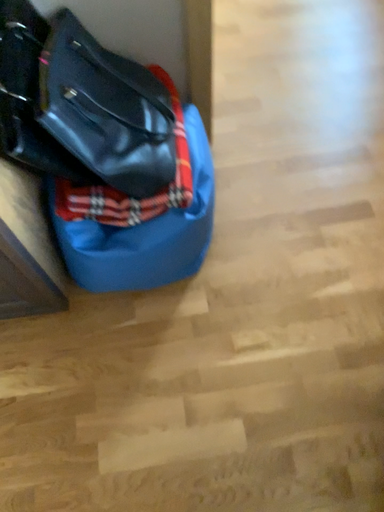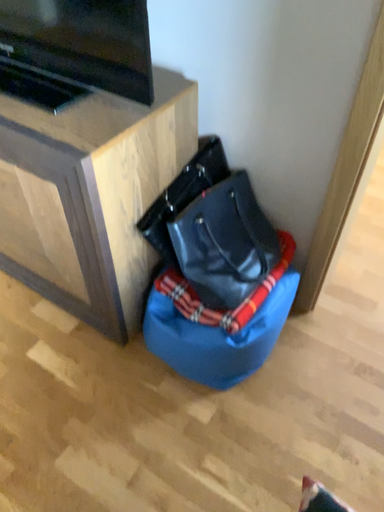
Question: Which way did the camera rotate in the video?

Choices:
 (A) rotated downward
 (B) rotated upward

Answer: (B)